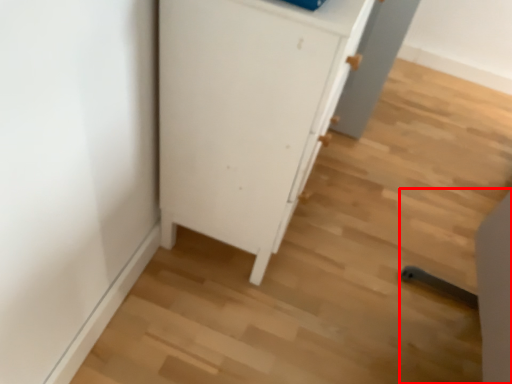
Question: Where is chair (annotated by the red box) located in relation to cupboard in the image?

Choices:
 (A) left
 (B) right

Answer: (B)